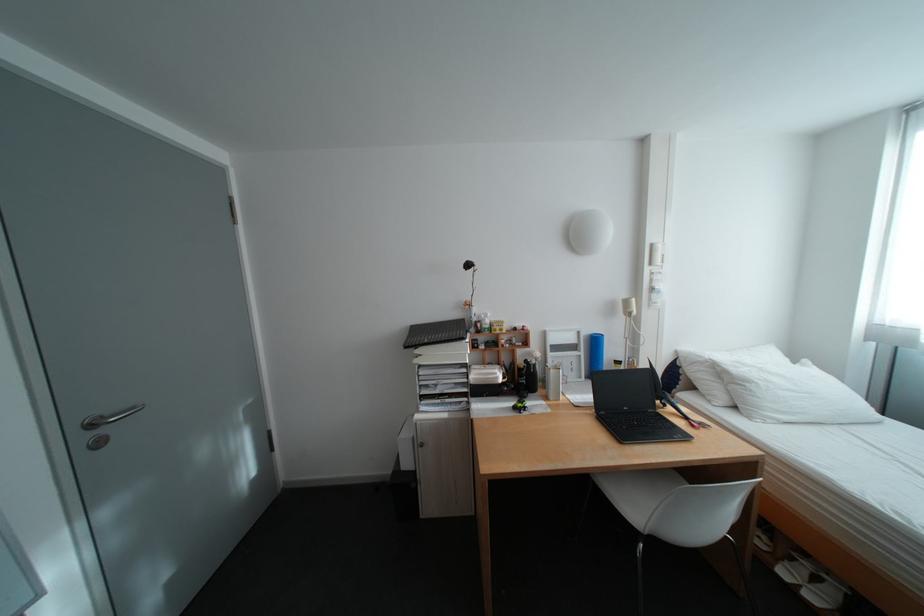
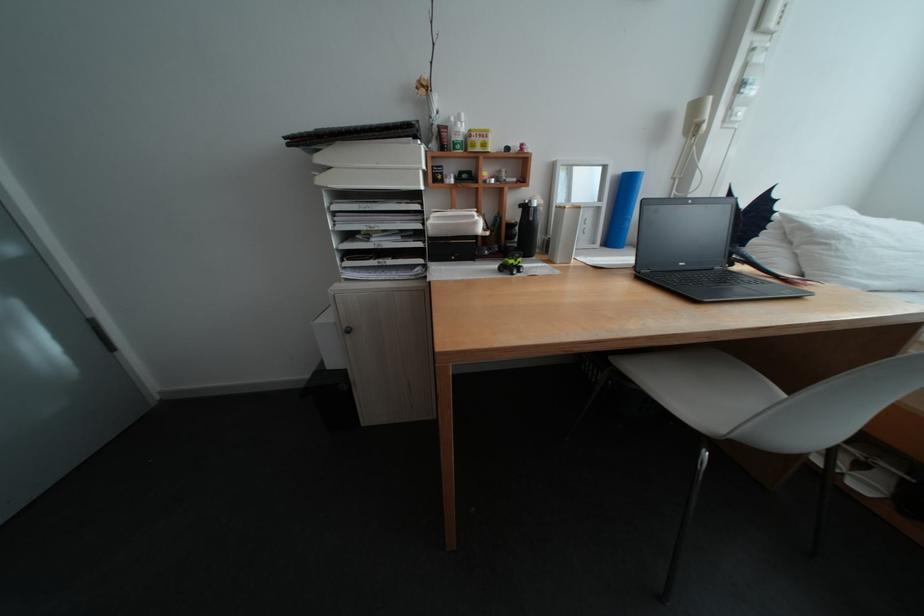
Locate, in the second image, the point that corresponds to (430,352) in the first image.

(333, 160)